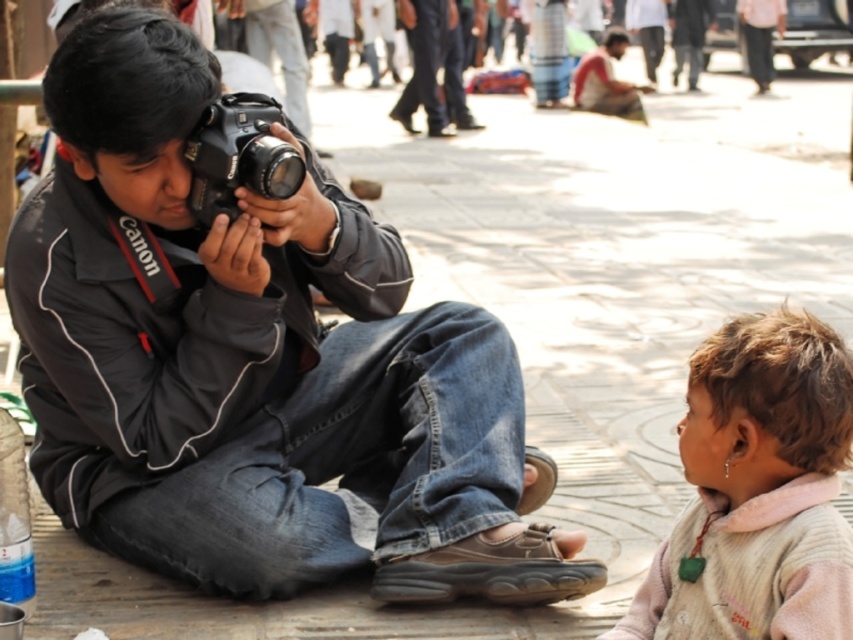
Who is lower down, light brown hair at lower right or black plastic camera at left?

light brown hair at lower right is lower down.

Which is behind, point (735, 326) or point (258, 173)?

Positioned behind is point (258, 173).

Is point (764, 364) positioned after point (230, 128)?

No.

Locate an element on the screen. light brown hair at lower right is located at coordinates coord(758,490).

Is black plastic camera at left smaller than dark blue jeans at center?

Correct, black plastic camera at left occupies less space than dark blue jeans at center.

Who is more forward, [218,106] or [432,93]?

Point [218,106]

Describe the element at coordinates (238, 156) in the screenshot. I see `black plastic camera at left` at that location.

The image size is (853, 640). Identify the location of black plastic camera at left. (238, 156).

Which is above, light brown hair at lower right or dark blue jeans at center?

dark blue jeans at center is higher up.

Is light brown hair at lower right below dark blue jeans at center?

Yes, light brown hair at lower right is below dark blue jeans at center.

Who is more forward, (723, 477) or (405, 32)?

Point (723, 477)

In order to click on light brown hair at lower right in this screenshot , I will do `click(758, 490)`.